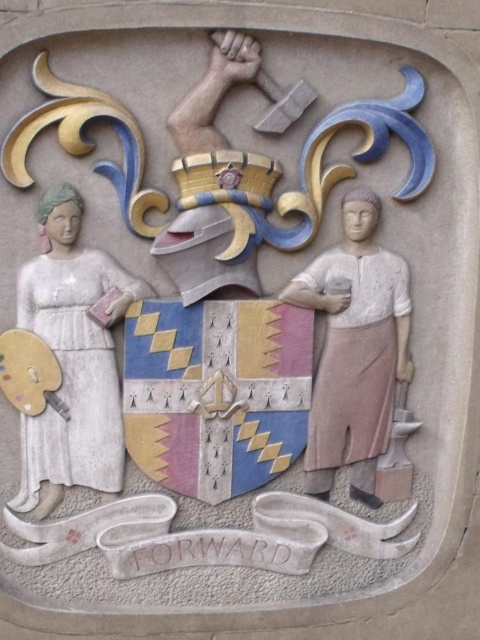
Question: Is smooth white dress at left below stone figure at center?

Choices:
 (A) no
 (B) yes

Answer: (B)

Question: Does smooth white dress at left have a greater width compared to stone figure at center?

Choices:
 (A) yes
 (B) no

Answer: (A)

Question: Can you confirm if smooth white dress at left is bigger than stone figure at center?

Choices:
 (A) no
 (B) yes

Answer: (B)

Question: Which point is farther from the camera taking this photo?

Choices:
 (A) (81, 282)
 (B) (397, 275)

Answer: (B)